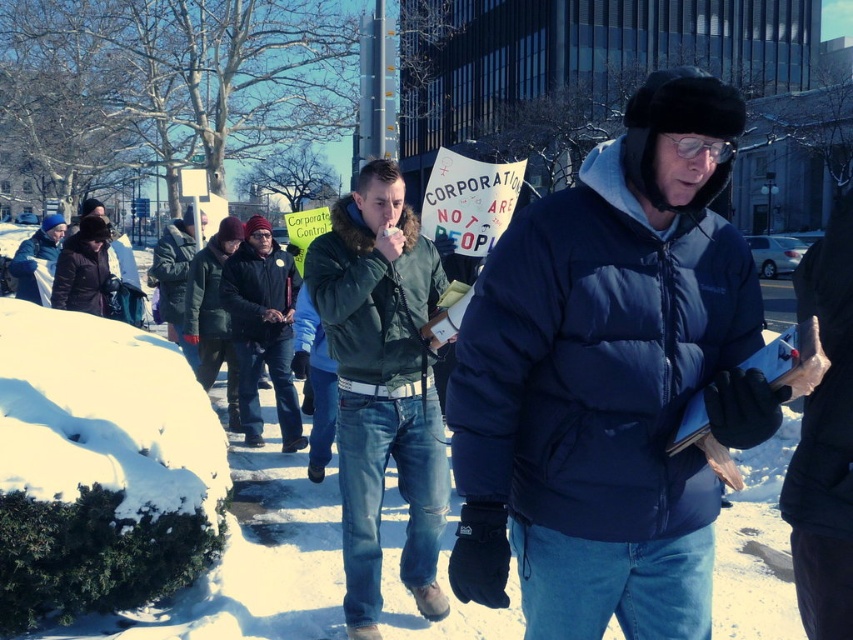
Between point (383, 464) and point (167, 305), which one is positioned behind?

Point (167, 305)

Can you confirm if green matte jacket at center is positioned to the left of dark green jacket at center?

Incorrect, green matte jacket at center is not on the left side of dark green jacket at center.

Between point (412, 305) and point (178, 282), which one is positioned behind?

Positioned behind is point (178, 282).

What are the coordinates of `green matte jacket at center` in the screenshot? It's located at (381, 387).

Who is taller, dark blue jacket at center or dark green jacket at center?

With more height is dark green jacket at center.

Is dark blue jacket at center further to camera compared to dark green jacket at center?

No, dark blue jacket at center is closer to the viewer.

What do you see at coordinates (262, 330) in the screenshot? I see `dark blue jacket at center` at bounding box center [262, 330].

You are a GUI agent. You are given a task and a screenshot of the screen. Output one action in this format:
    pyautogui.click(x=<x>, y=<y>)
    Task: Click on the dark blue jacket at center
    
    Given the screenshot: What is the action you would take?
    click(262, 330)

Is dark blue jacket at center wider than matte black jacket at left?

Incorrect, dark blue jacket at center's width does not surpass matte black jacket at left's.

Can you confirm if dark blue jacket at center is bigger than matte black jacket at left?

Actually, dark blue jacket at center might be smaller than matte black jacket at left.

Locate an element on the screen. Image resolution: width=853 pixels, height=640 pixels. dark blue jacket at center is located at coordinates (262, 330).

You are a GUI agent. You are given a task and a screenshot of the screen. Output one action in this format:
    pyautogui.click(x=<x>, y=<y>)
    Task: Click on the dark blue jacket at center
    Image resolution: width=853 pixels, height=640 pixels.
    Given the screenshot: What is the action you would take?
    pyautogui.click(x=262, y=330)